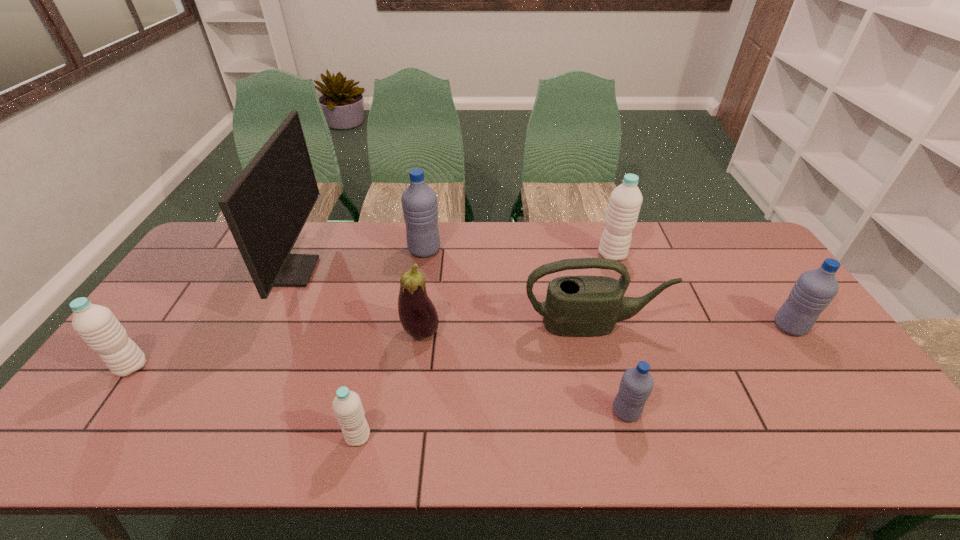
The width and height of the screenshot is (960, 540). What are the coordinates of `vacant region at the right edge` in the screenshot? It's located at (807, 383).

Locate an element on the screen. This screenshot has width=960, height=540. blank space at the far left corner of the desktop is located at coordinates (221, 233).

You are a GUI agent. You are given a task and a screenshot of the screen. Output one action in this format:
    pyautogui.click(x=<x>, y=<y>)
    Task: Click on the empty location between the second nearest object and the rightmost water bottle
    
    Given the screenshot: What is the action you would take?
    pyautogui.click(x=708, y=369)

Locate an element on the screen. The width and height of the screenshot is (960, 540). vacant area that lies between the rightmost white water bottle and the second smallest white water bottle is located at coordinates (372, 311).

Identify the location of vacant area that lies between the farthest blue water bottle and the leftmost white water bottle. (278, 308).

Image resolution: width=960 pixels, height=540 pixels. In order to click on free spot between the smallest white water bottle and the fifth water bottle from left to right in this screenshot , I will do `click(485, 346)`.

I want to click on free spot between the watering can and the eggplant, so click(507, 328).

Locate an element on the screen. The image size is (960, 540). free spot between the computer monitor and the leftmost object is located at coordinates (213, 319).

Where is `vacant region between the second smallest white water bottle and the rightmost white water bottle`? This screenshot has width=960, height=540. vacant region between the second smallest white water bottle and the rightmost white water bottle is located at coordinates (372, 311).

The width and height of the screenshot is (960, 540). In order to click on free space between the green watering can and the leftmost white water bottle in this screenshot , I will do `click(362, 346)`.